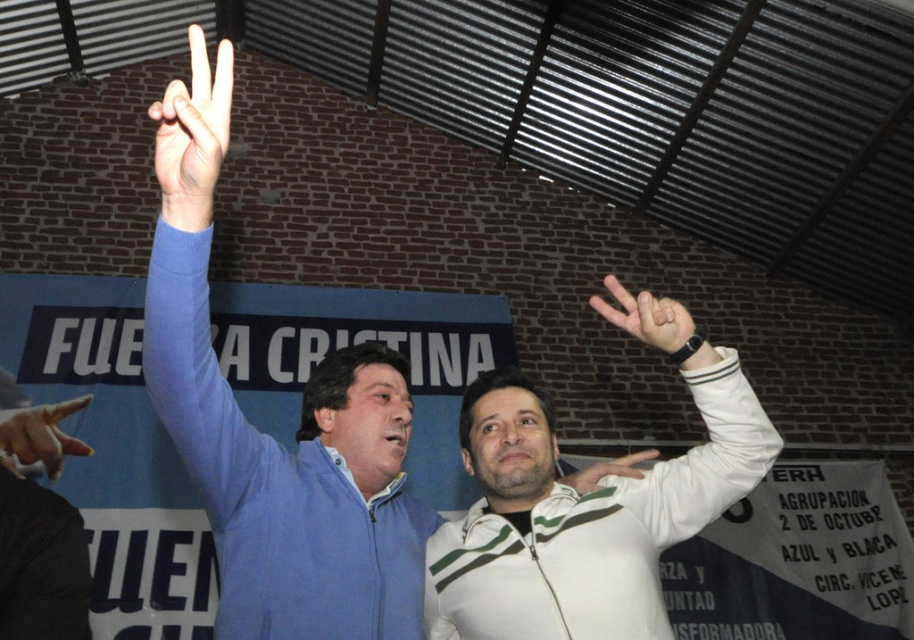
Measure the distance from blue zip-up jacket at upper left to blue fabric sleeve at upper left.

blue zip-up jacket at upper left and blue fabric sleeve at upper left are 6.23 inches apart.

Can you confirm if blue zip-up jacket at upper left is positioned below blue fabric sleeve at upper left?

Yes.

Is point (193, 36) more distant than point (202, 445)?

No, (193, 36) is in front of (202, 445).

What are the coordinates of `blue zip-up jacket at upper left` in the screenshot? It's located at (270, 436).

Which is below, white striped jacket at upper right or matte blue hand at upper left?

Positioned lower is white striped jacket at upper right.

Image resolution: width=914 pixels, height=640 pixels. Find the location of `white striped jacket at upper right`. white striped jacket at upper right is located at coordinates (707, 452).

This screenshot has height=640, width=914. What are the coordinates of `white striped jacket at upper right` in the screenshot? It's located at (707, 452).

Can you confirm if white striped jacket at upper right is bigger than matte white hand at upper center?

Indeed, white striped jacket at upper right has a larger size compared to matte white hand at upper center.

I want to click on white striped jacket at upper right, so click(707, 452).